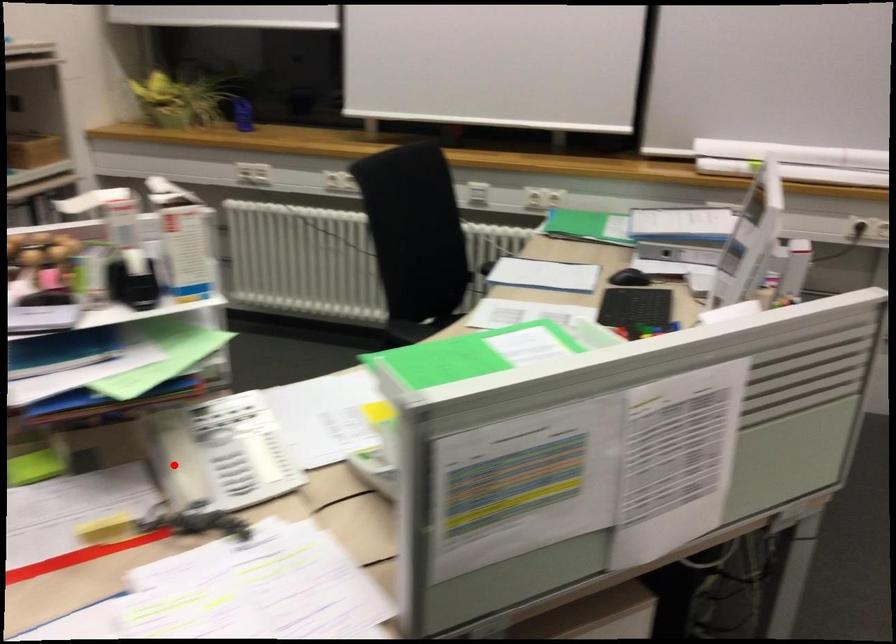
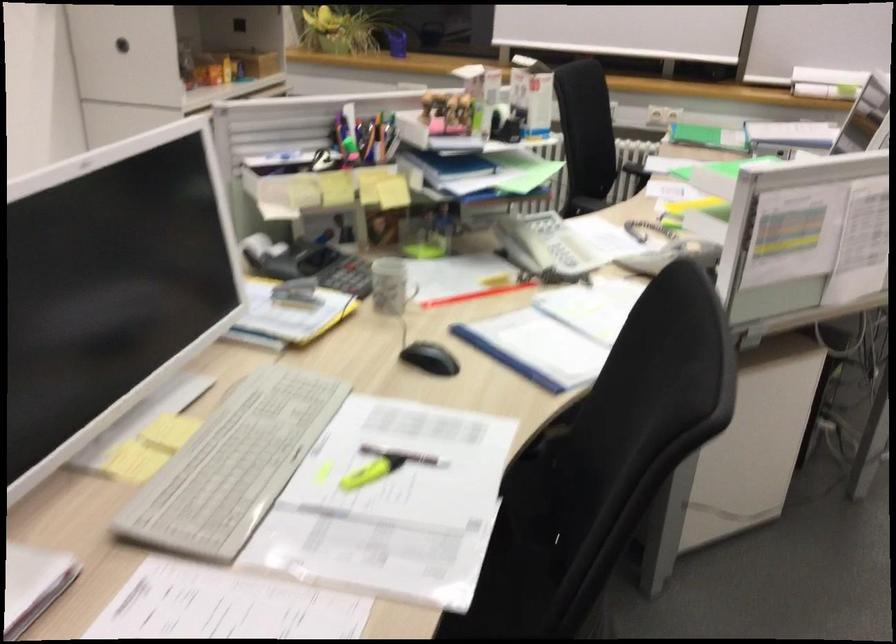
Where in the second image is the point corresponding to the highlighted location from the first image?

(522, 243)